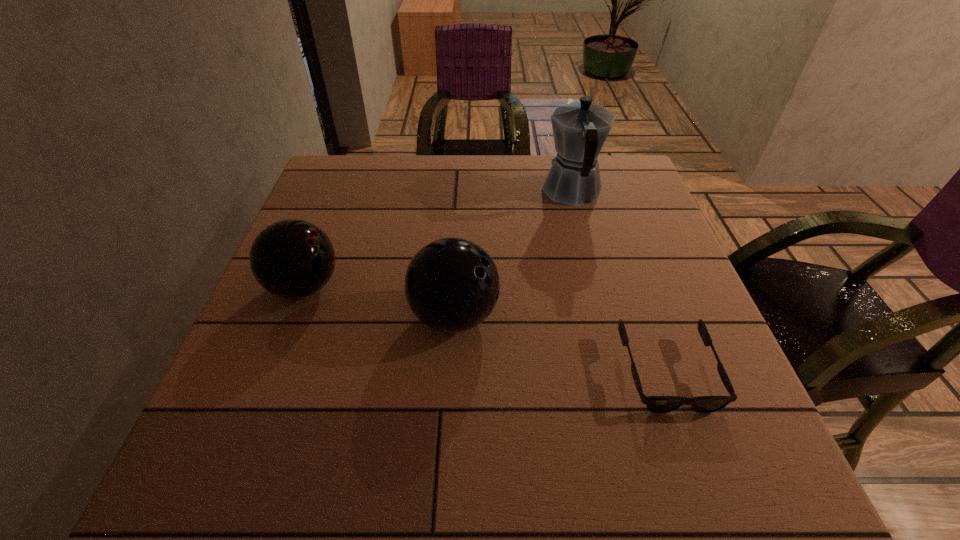
This screenshot has height=540, width=960. What are the coordinates of `the tallest object` in the screenshot? It's located at (580, 128).

Find the location of `the farthest object`. the farthest object is located at coordinates (580, 128).

Where is `the right bowling ball`? The width and height of the screenshot is (960, 540). the right bowling ball is located at coordinates (452, 285).

The image size is (960, 540). I want to click on the left bowling ball, so click(x=292, y=259).

The height and width of the screenshot is (540, 960). In order to click on sunglasses in this screenshot , I will do `click(657, 404)`.

The height and width of the screenshot is (540, 960). I want to click on free space located at the spout of the tallest object, so click(x=564, y=158).

I want to click on free space located 0.300m on the surface of the second object from left to right near the finger holes, so click(651, 316).

What are the coordinates of `free space located 0.160m on the surface of the left bowling ball near the finger holes` in the screenshot? It's located at (419, 287).

Image resolution: width=960 pixels, height=540 pixels. I want to click on vacant area located on the temples of the sunglasses, so click(x=693, y=447).

Where is `object situated at the far edge`? object situated at the far edge is located at coordinates (580, 128).